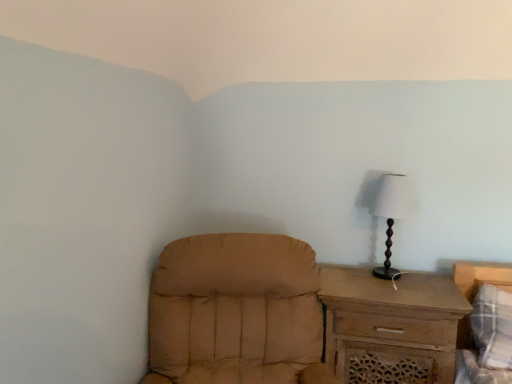
Question: Is white fabric lampshade at right oriented towards tan fabric chair at lower left?

Choices:
 (A) yes
 (B) no

Answer: (B)

Question: Can you confirm if white fabric lampshade at right is shorter than tan fabric chair at lower left?

Choices:
 (A) no
 (B) yes

Answer: (B)

Question: Considering the relative positions of white fabric lampshade at right and tan fabric chair at lower left in the image provided, is white fabric lampshade at right to the left of tan fabric chair at lower left from the viewer's perspective?

Choices:
 (A) no
 (B) yes

Answer: (A)

Question: Considering the relative positions of white fabric lampshade at right and tan fabric chair at lower left in the image provided, is white fabric lampshade at right to the right of tan fabric chair at lower left from the viewer's perspective?

Choices:
 (A) no
 (B) yes

Answer: (B)

Question: Is white fabric lampshade at right outside of tan fabric chair at lower left?

Choices:
 (A) yes
 (B) no

Answer: (A)

Question: From the image's perspective, is white fabric lampshade at right under tan fabric chair at lower left?

Choices:
 (A) yes
 (B) no

Answer: (B)

Question: Can you confirm if plaid fabric bed at lower right is bigger than tan fabric chair at lower left?

Choices:
 (A) no
 (B) yes

Answer: (A)

Question: Does plaid fabric bed at lower right turn towards tan fabric chair at lower left?

Choices:
 (A) no
 (B) yes

Answer: (A)

Question: Can you confirm if plaid fabric bed at lower right is wider than tan fabric chair at lower left?

Choices:
 (A) yes
 (B) no

Answer: (B)

Question: Can you confirm if plaid fabric bed at lower right is taller than tan fabric chair at lower left?

Choices:
 (A) no
 (B) yes

Answer: (A)

Question: Is plaid fabric bed at lower right to the left of tan fabric chair at lower left from the viewer's perspective?

Choices:
 (A) yes
 (B) no

Answer: (B)

Question: Is tan fabric chair at lower left located within plaid fabric bed at lower right?

Choices:
 (A) no
 (B) yes

Answer: (A)

Question: From the image's perspective, does tan fabric chair at lower left appear higher than white fabric lampshade at right?

Choices:
 (A) no
 (B) yes

Answer: (A)